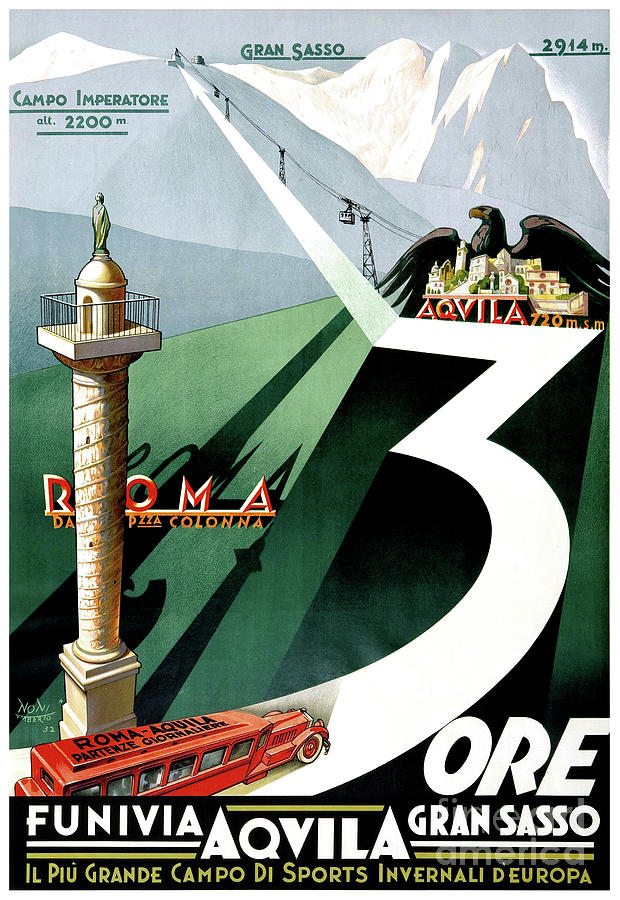
The width and height of the screenshot is (620, 900). Find the location of `cable`. cable is located at coordinates (381, 223), (395, 222), (405, 230).